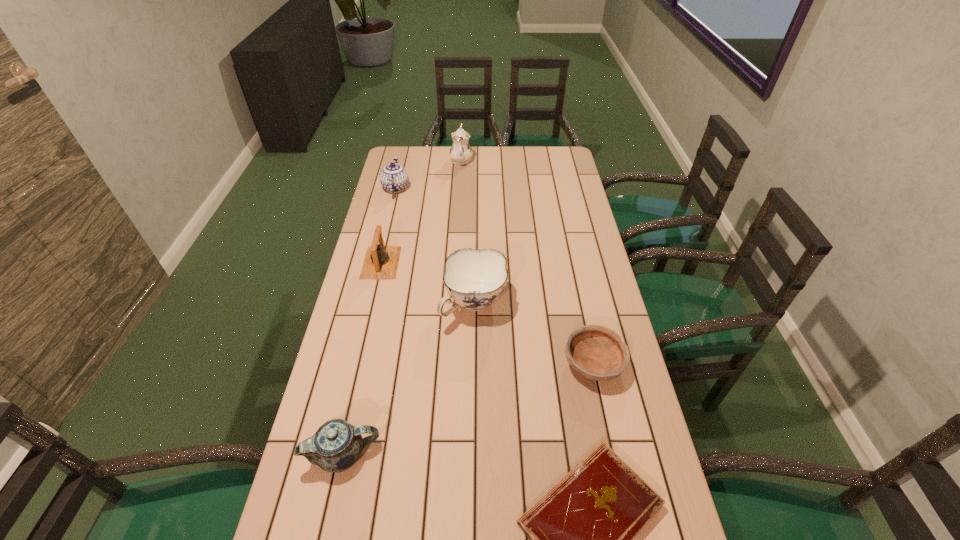
The height and width of the screenshot is (540, 960). What are the coordinates of `the farthest chinaware` in the screenshot? It's located at (460, 152).

This screenshot has height=540, width=960. Identify the location of the second nearest chinaware. (474, 279).

Locate an element on the screen. The width and height of the screenshot is (960, 540). the second farthest object is located at coordinates (394, 178).

The width and height of the screenshot is (960, 540). I want to click on bell, so click(x=381, y=262).

Where is `the nearest chinaware`? the nearest chinaware is located at coordinates [336, 446].

Locate an element on the screen. This screenshot has height=540, width=960. the fifth farthest object is located at coordinates (595, 352).

This screenshot has width=960, height=540. Find the location of `the sixth tallest object`. the sixth tallest object is located at coordinates (595, 352).

Locate an element on the screen. The image size is (960, 540). vacant space located 0.050m on the front of the farthest object is located at coordinates (461, 175).

The image size is (960, 540). I want to click on free spot located 0.290m on the right of the second nearest chinaware, so click(595, 304).

The image size is (960, 540). What are the coordinates of `free space located 0.070m at the spout of the second farthest object` in the screenshot? It's located at (401, 167).